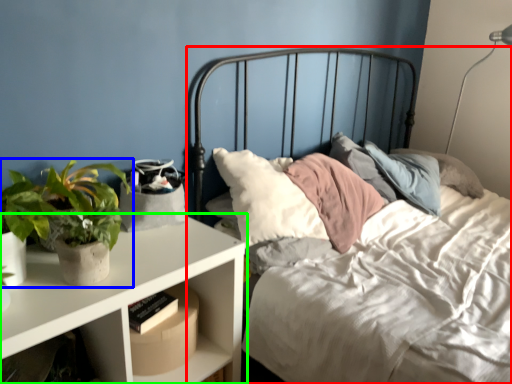
Question: Estimate the real-world distances between objects in this image. Which object is farther from bed (highlighted by a red box), houseplant (highlighted by a blue box) or nightstand (highlighted by a green box)?

Choices:
 (A) houseplant
 (B) nightstand

Answer: (A)